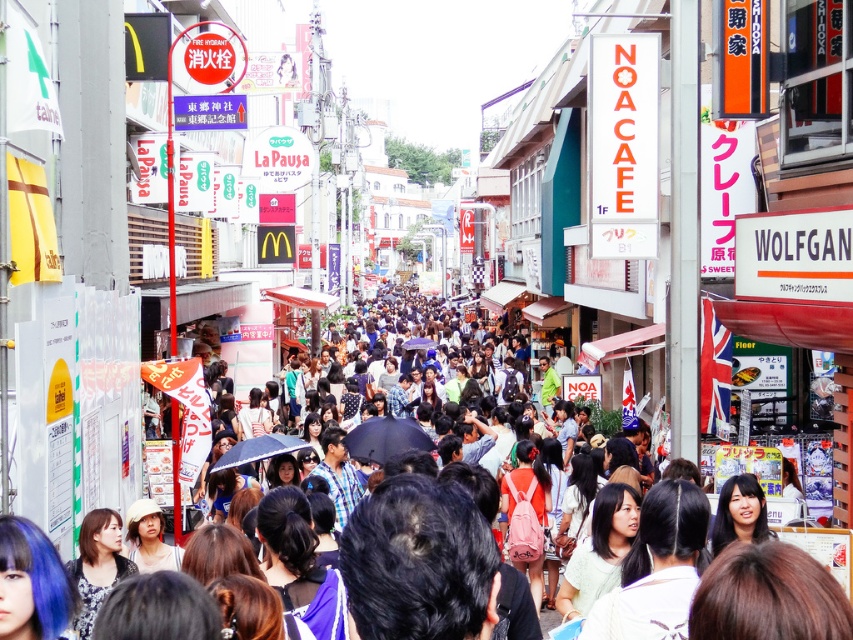
Which is more to the left, black matte umbrella at center or transparent blue umbrella at center?

Positioned to the left is transparent blue umbrella at center.

Is black matte umbrella at center positioned before transparent blue umbrella at center?

No.

Which is behind, point (357, 438) or point (245, 451)?

The point (357, 438) is behind.

Locate an element on the screen. black matte umbrella at center is located at coordinates (386, 438).

Consider the image. Is matte black umbrella at center smaller than transparent blue umbrella at center?

No, matte black umbrella at center is not smaller than transparent blue umbrella at center.

Can you confirm if matte black umbrella at center is taller than transparent blue umbrella at center?

Indeed, matte black umbrella at center has a greater height compared to transparent blue umbrella at center.

Between point (28, 508) and point (254, 458), which one is positioned behind?

The point (254, 458) is more distant.

This screenshot has width=853, height=640. I want to click on matte black umbrella at center, so click(x=82, y=390).

Between point (45, 285) and point (369, 458), which one is positioned behind?

Point (369, 458)

Who is more forward, (131, 317) or (384, 456)?

Point (131, 317)

Is point (42, 444) in front of point (399, 445)?

Yes, point (42, 444) is closer to viewer.

The image size is (853, 640). Find the location of `matte black umbrella at center`. matte black umbrella at center is located at coordinates (82, 390).